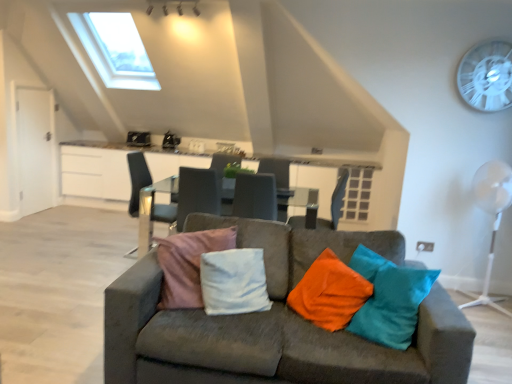
Question: Is transparent plastic fan at upper right completely or partially outside of velvet grey couch at center?

Choices:
 (A) yes
 (B) no

Answer: (A)

Question: Can you confirm if transparent plastic fan at upper right is taller than velvet grey couch at center?

Choices:
 (A) yes
 (B) no

Answer: (B)

Question: Does transparent plastic fan at upper right have a greater width compared to velvet grey couch at center?

Choices:
 (A) no
 (B) yes

Answer: (A)

Question: Can you confirm if transparent plastic fan at upper right is positioned to the left of velvet grey couch at center?

Choices:
 (A) yes
 (B) no

Answer: (B)

Question: Considering the relative sizes of transparent plastic fan at upper right and velvet grey couch at center in the image provided, is transparent plastic fan at upper right smaller than velvet grey couch at center?

Choices:
 (A) no
 (B) yes

Answer: (B)

Question: From the image's perspective, is transparent plastic fan at upper right located beneath velvet grey couch at center?

Choices:
 (A) yes
 (B) no

Answer: (B)

Question: Is metallic silver chair at center, the first chair when ordered from left to right, shorter than velvet grey couch at center?

Choices:
 (A) yes
 (B) no

Answer: (B)

Question: From the image's perspective, is metallic silver chair at center, the first chair when ordered from left to right, under velvet grey couch at center?

Choices:
 (A) no
 (B) yes

Answer: (A)

Question: Does metallic silver chair at center, the first chair when ordered from left to right, have a greater width compared to velvet grey couch at center?

Choices:
 (A) yes
 (B) no

Answer: (B)

Question: Is metallic silver chair at center, the first chair when ordered from left to right, smaller than velvet grey couch at center?

Choices:
 (A) no
 (B) yes

Answer: (B)

Question: Is the position of metallic silver chair at center, the second chair from the right, more distant than that of velvet grey couch at center?

Choices:
 (A) yes
 (B) no

Answer: (A)

Question: Does metallic silver chair at center, the second chair from the right, turn towards velvet grey couch at center?

Choices:
 (A) no
 (B) yes

Answer: (A)

Question: Is velvet grey couch at center outside white plastic mechanical fan at right?

Choices:
 (A) no
 (B) yes

Answer: (B)